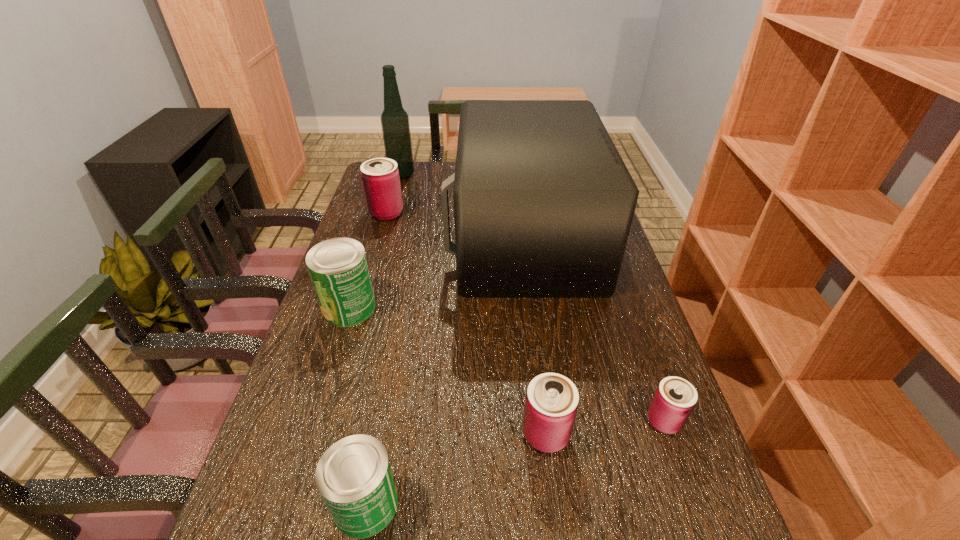
Locate an element on the screen. This screenshot has width=960, height=540. the right green can is located at coordinates (x=354, y=477).

The image size is (960, 540). I want to click on the shortest object, so click(x=675, y=398).

Where is `the smallest pink can`? The height and width of the screenshot is (540, 960). the smallest pink can is located at coordinates (675, 398).

What are the coordinates of `vacant area located on the right of the farthest object` in the screenshot? It's located at (495, 174).

Locate an element on the screen. The width and height of the screenshot is (960, 540). free point located 0.050m on the front-facing side of the sixth shortest object is located at coordinates (434, 237).

Locate an element on the screen. vacant region located 0.190m on the front-facing side of the sixth shortest object is located at coordinates (391, 237).

The width and height of the screenshot is (960, 540). What are the coordinates of `vacant space positioned 0.220m on the front-facing side of the sixth shortest object` in the screenshot? It's located at (381, 237).

Where is `free space located 0.320m on the back of the farthest can`? The height and width of the screenshot is (540, 960). free space located 0.320m on the back of the farthest can is located at coordinates (401, 163).

Find the location of a particular element. vacant position located 0.380m on the right of the fourth nearest can is located at coordinates (516, 307).

Where is `free spot located on the right of the second smallest pink can`? free spot located on the right of the second smallest pink can is located at coordinates (653, 434).